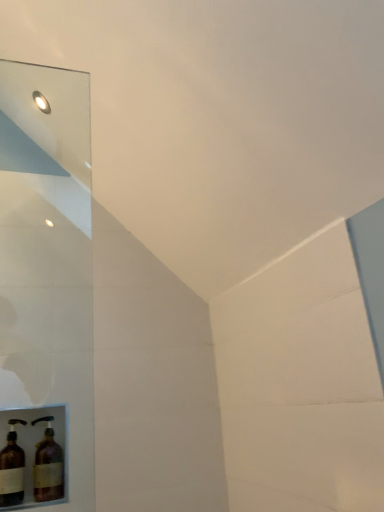
Question: Is point (61, 461) positioned closer to the camera than point (14, 467)?

Choices:
 (A) closer
 (B) farther

Answer: (B)

Question: From the image's perspective, is brown glass bottle at lower left, which appears as the 2th bottle when viewed from the left, located above or below brown glass bottle at lower left, marked as the 1th bottle in a left-to-right arrangement?

Choices:
 (A) below
 (B) above

Answer: (A)

Question: Would you say brown glass bottle at lower left, which ranks as the 1th bottle in right-to-left order, is to the left or to the right of brown glass bottle at lower left, marked as the 1th bottle in a left-to-right arrangement, in the picture?

Choices:
 (A) left
 (B) right

Answer: (B)

Question: Do you think brown glass bottle at lower left, arranged as the 2th bottle when viewed from the right, is within brown glass bottle at lower left, which ranks as the 1th bottle in right-to-left order, or outside of it?

Choices:
 (A) inside
 (B) outside

Answer: (B)

Question: Considering the positions of brown glass bottle at lower left, marked as the 1th bottle in a left-to-right arrangement, and brown glass bottle at lower left, which ranks as the 1th bottle in right-to-left order, in the image, is brown glass bottle at lower left, marked as the 1th bottle in a left-to-right arrangement, wider or thinner than brown glass bottle at lower left, which ranks as the 1th bottle in right-to-left order,?

Choices:
 (A) thin
 (B) wide

Answer: (A)

Question: Considering the positions of brown glass bottle at lower left, marked as the 1th bottle in a left-to-right arrangement, and brown glass bottle at lower left, which ranks as the 1th bottle in right-to-left order, in the image, is brown glass bottle at lower left, marked as the 1th bottle in a left-to-right arrangement, bigger or smaller than brown glass bottle at lower left, which ranks as the 1th bottle in right-to-left order,?

Choices:
 (A) big
 (B) small

Answer: (B)

Question: Is point (11, 443) closer or farther from the camera than point (39, 449)?

Choices:
 (A) closer
 (B) farther

Answer: (A)